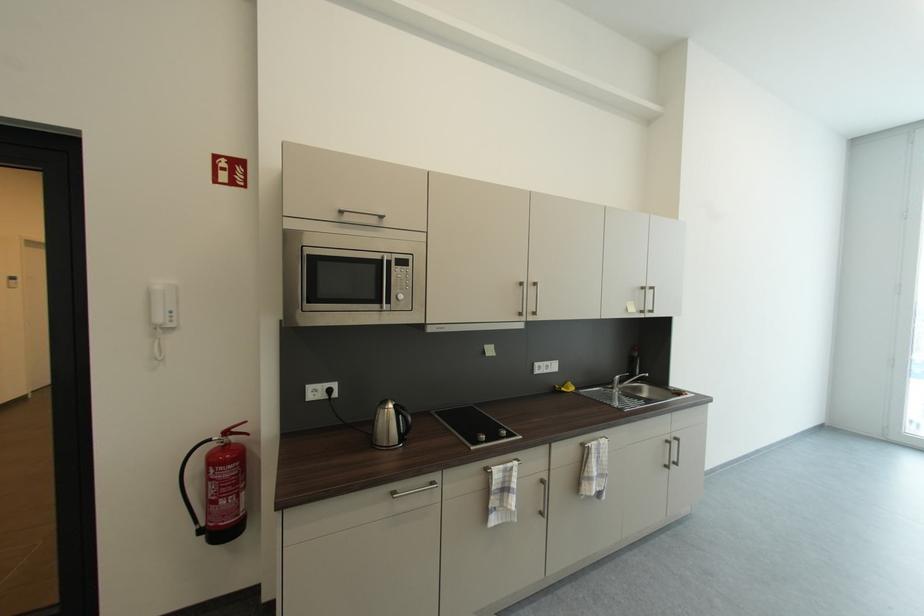
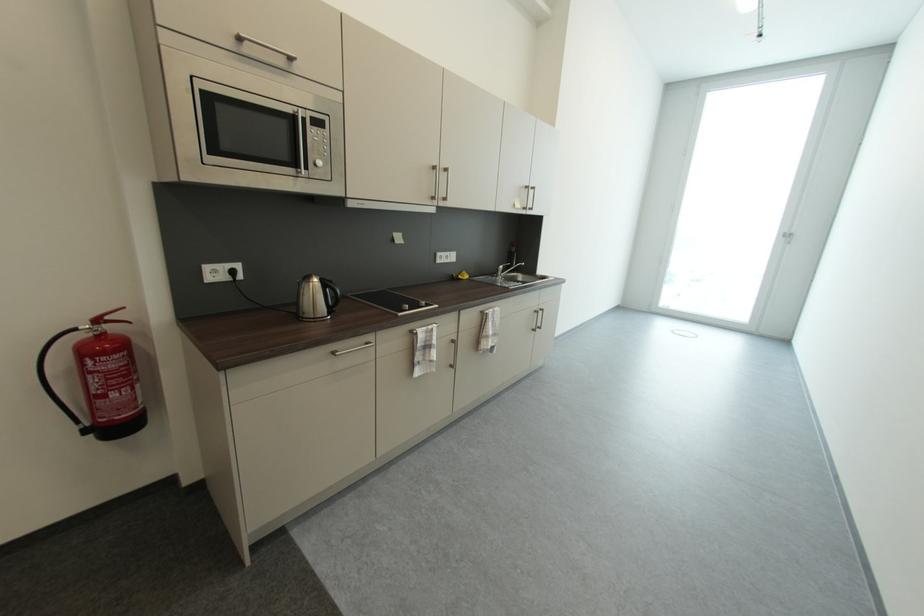
Find the pixel in the second image that matches point 239,431 in the first image.

(116, 318)